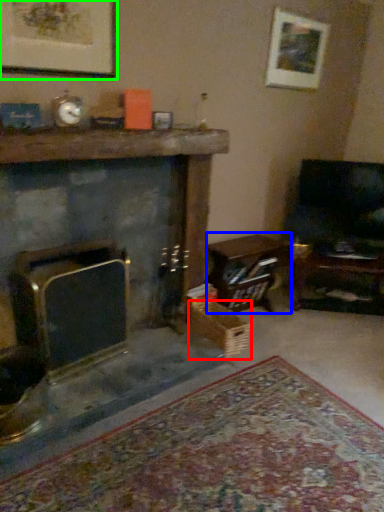
Question: Estimate the real-world distances between objects in this image. Which object is farther from crate (highlighted by a red box), table (highlighted by a blue box) or picture frame (highlighted by a green box)?

Choices:
 (A) table
 (B) picture frame

Answer: (B)